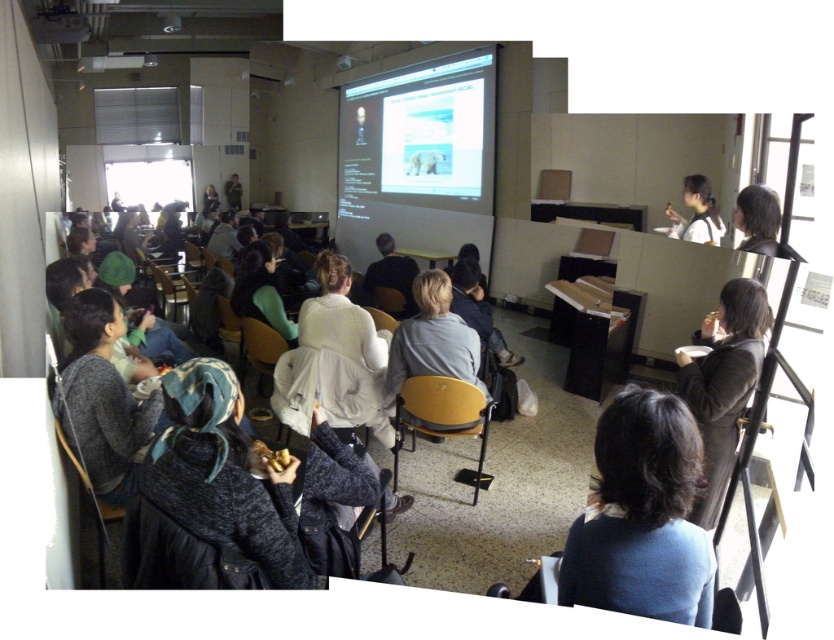
Which is more to the right, white matte projection screen at center or dark brown leather jacket at right?

Positioned to the right is dark brown leather jacket at right.

Who is more forward, (x=374, y=129) or (x=729, y=456)?

Positioned in front is point (x=729, y=456).

Does point (455, 163) come in front of point (712, 346)?

No, it is not.

Find the location of a particular element. white matte projection screen at center is located at coordinates (418, 154).

Is white matte projection screen at center taller than dark brown hair at upper right?

Indeed, white matte projection screen at center has a greater height compared to dark brown hair at upper right.

Is point (425, 228) positioned in front of point (751, 225)?

No.

The image size is (834, 640). Identify the location of white matte projection screen at center. click(418, 154).

Is dark brown leather jacket at right to the right of white matte jacket at upper right from the viewer's perspective?

In fact, dark brown leather jacket at right is to the left of white matte jacket at upper right.

Does point (762, 346) come behind point (689, 236)?

No, (762, 346) is closer to viewer.

Locate an element on the screen. dark brown leather jacket at right is located at coordinates (722, 384).